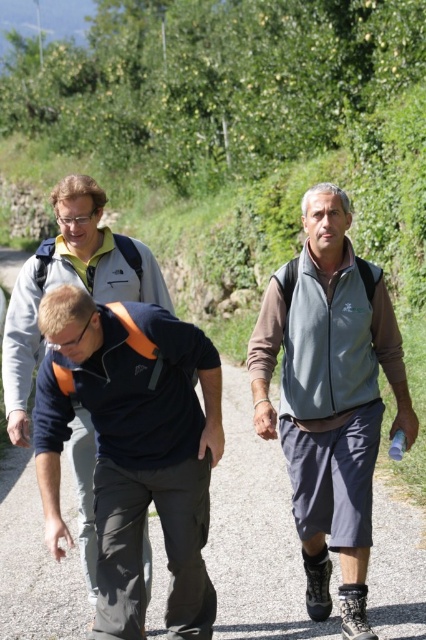
You are a photographer trying to capture a photo of the dark blue fabric shirt at center and the dark blue fabric pants at lower left. Which object should you focus on first if you want to include both in the frame without moving the camera?

You should focus on the dark blue fabric shirt at center first because it is closer to the camera than the dark blue fabric pants at lower left, allowing both to be in the frame without moving the camera.

You are a hiker planning to join the group in the image. You need to know if you can comfortably walk between the dark blue fabric shirt at center and the matte black jacket at center without bumping into them. The width of your backpack is 0.5 meters. Can you fit through the space between them?

The distance between the dark blue fabric shirt at center and the matte black jacket at center is 1.09 meters. Since your backpack is 0.5 meters wide, there is enough space to comfortably walk through without bumping into them.